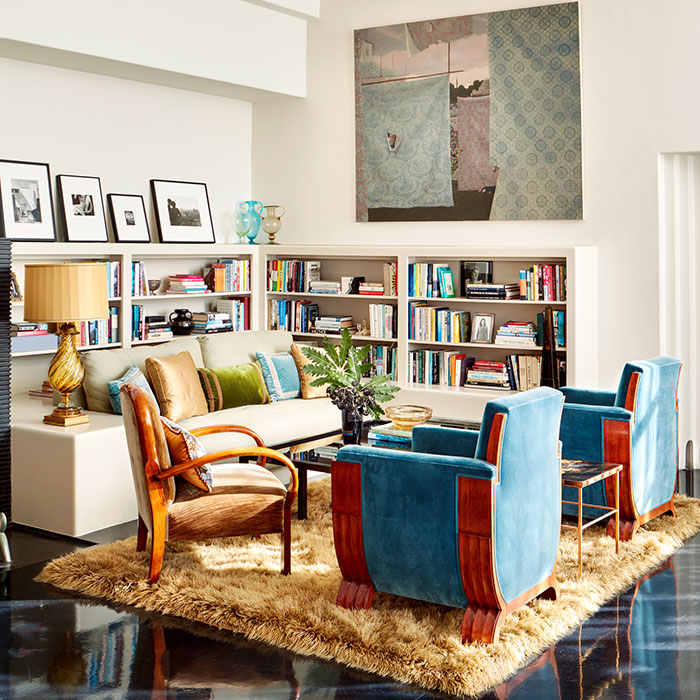
Find the location of `rug`. rug is located at coordinates (239, 596), (316, 535), (435, 666), (602, 578).